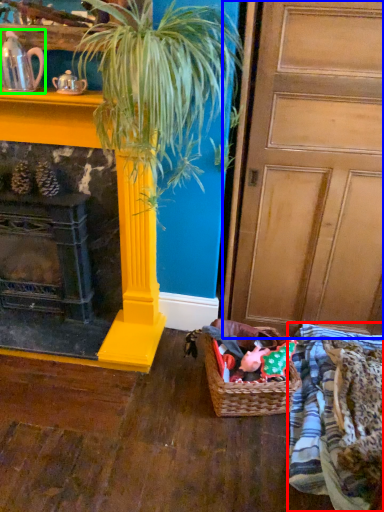
Question: Which object is positioned closest to clothing (highlighted by a red box)? Select from door (highlighted by a blue box) and tea pot (highlighted by a green box).

Choices:
 (A) door
 (B) tea pot

Answer: (A)